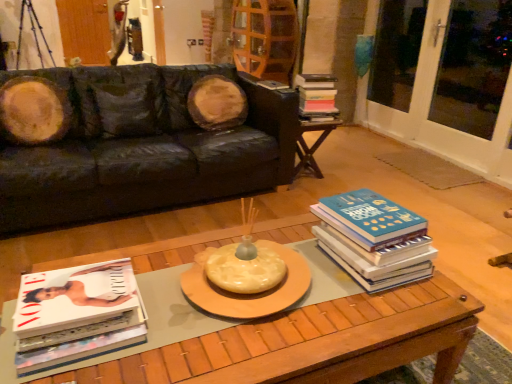
Identify the location of free space above white glossy magazine at lower left, which ranks as the 1th book in left-to-right order (from a real-world perspective). This screenshot has height=384, width=512. (78, 294).